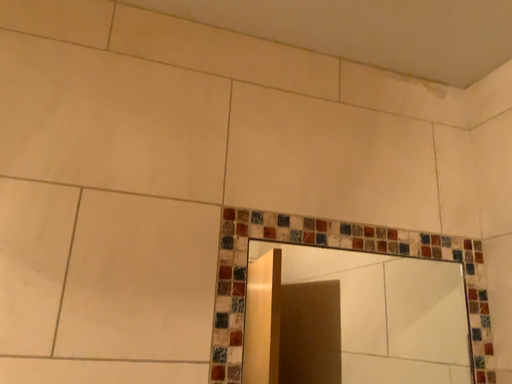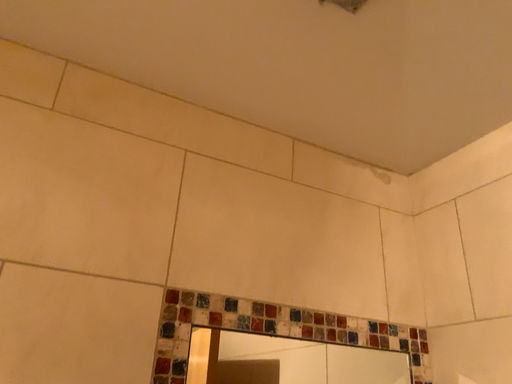
Question: Which way did the camera rotate in the video?

Choices:
 (A) rotated upward
 (B) rotated downward

Answer: (A)